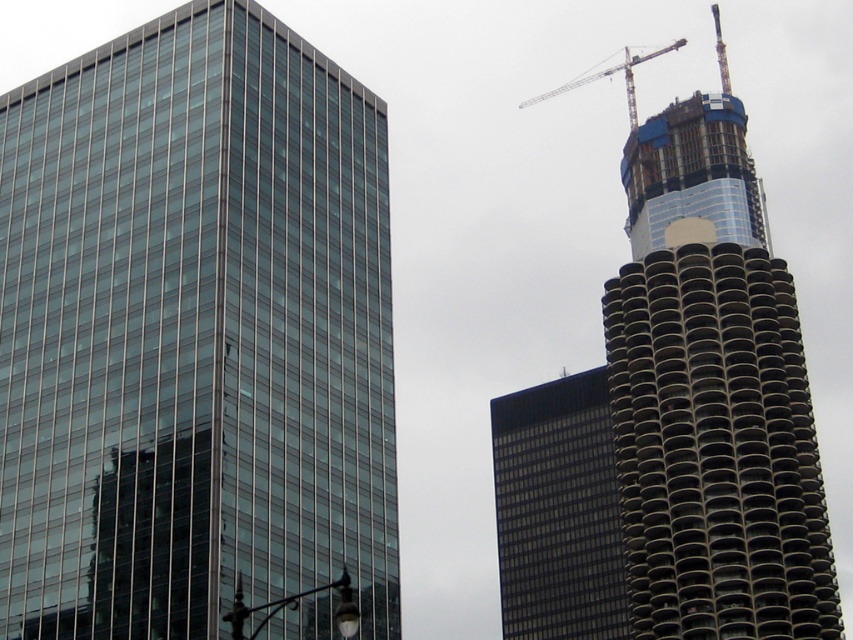
You are a city planner observing the urban skyline. You need to determine which object is closer to the city center. Based on the scene, which is closer to you between the matte glass skyscraper at center and the metallic gray crane at upper right?

The matte glass skyscraper at center is closer to the viewer than the metallic gray crane at upper right, so it is closer to the city center.

You are an urban planner assessing the safety of a new construction project. You need to ensure that the metallic gray crane at upper right maintains a minimum distance of 50 meters from the matte glass skyscraper at center to prevent structural interference. Based on the image, does the current placement meet this requirement?

The distance between the matte glass skyscraper at center and the metallic gray crane at upper right is 57.20 meters, which exceeds the required 50 meters. Therefore, the current placement meets the safety requirement.

Consider the image. You are standing in front of the urban skyline and want to determine which of the two points, point (733, 125) or point (572, 81), is closer to you. Based on the scene, can you identify the closer point?

Point (733, 125) is closer to the viewer than point (572, 81).